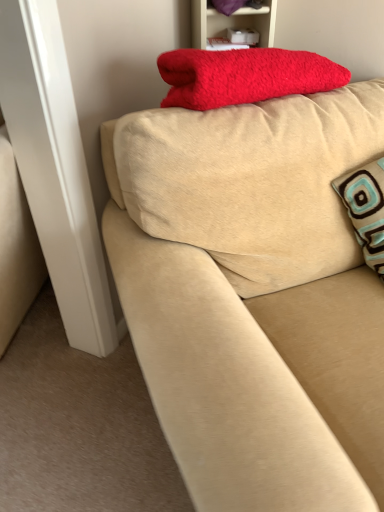
Question: From the image's perspective, is beige fabric couch at upper center positioned above or below red fluffy blanket at upper center?

Choices:
 (A) below
 (B) above

Answer: (A)

Question: Considering the positions of point (367, 318) and point (193, 20), is point (367, 318) closer or farther from the camera than point (193, 20)?

Choices:
 (A) farther
 (B) closer

Answer: (B)

Question: Is beige fabric couch at upper center spatially inside red fluffy blanket at upper center, or outside of it?

Choices:
 (A) outside
 (B) inside

Answer: (A)

Question: Is point (271, 26) positioned closer to the camera than point (226, 155)?

Choices:
 (A) farther
 (B) closer

Answer: (A)

Question: Is red fluffy blanket at upper center bigger or smaller than beige fabric couch at upper center?

Choices:
 (A) big
 (B) small

Answer: (B)

Question: In the image, is red fluffy blanket at upper center on the left side or the right side of beige fabric couch at upper center?

Choices:
 (A) right
 (B) left

Answer: (B)

Question: Choose the correct answer: Is red fluffy blanket at upper center inside beige fabric couch at upper center or outside it?

Choices:
 (A) inside
 (B) outside

Answer: (B)